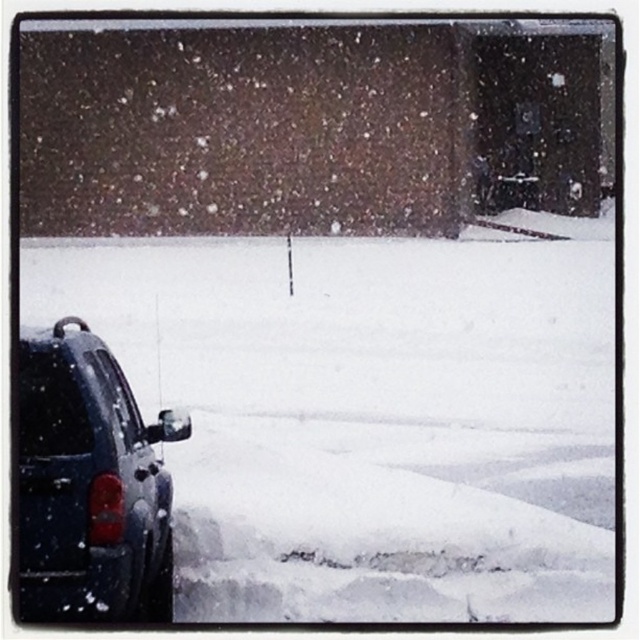
Does white fluffy snow at lower left appear under glossy dark blue car at lower left?

No.

Which is below, white fluffy snow at lower left or glossy dark blue car at lower left?

glossy dark blue car at lower left

Find the location of a particular element. The width and height of the screenshot is (640, 640). white fluffy snow at lower left is located at coordinates (369, 417).